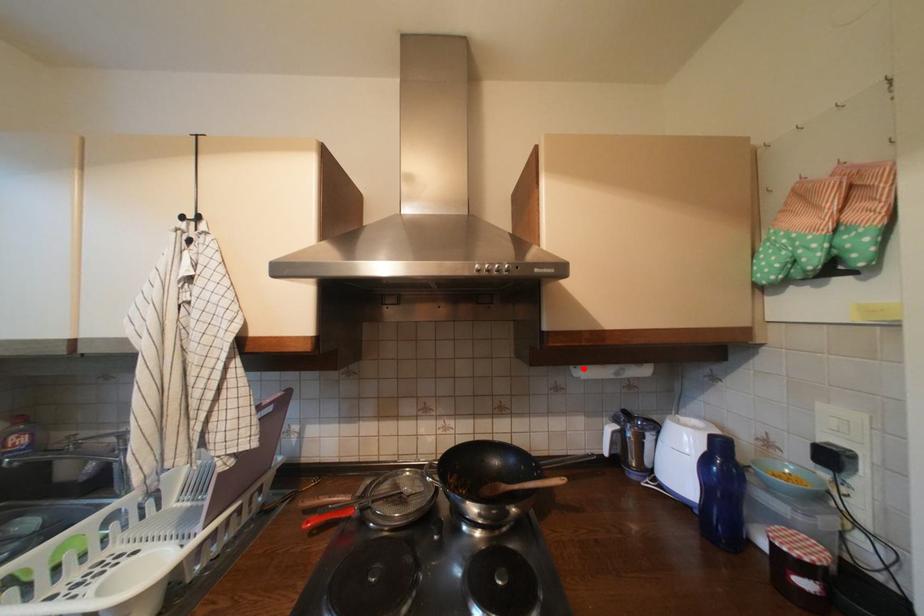
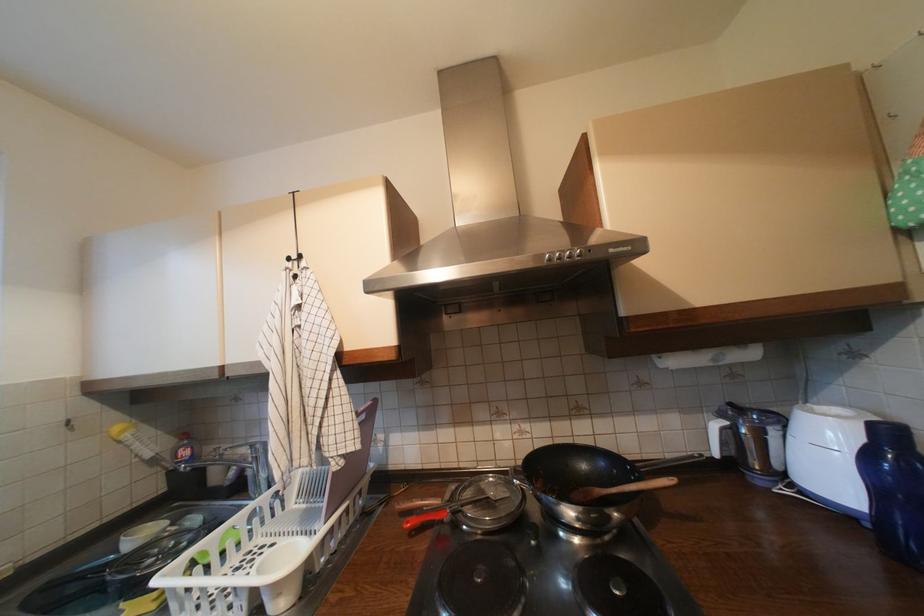
The point at the highlighted location is marked in the first image. Where is the corresponding point in the second image?

(669, 359)